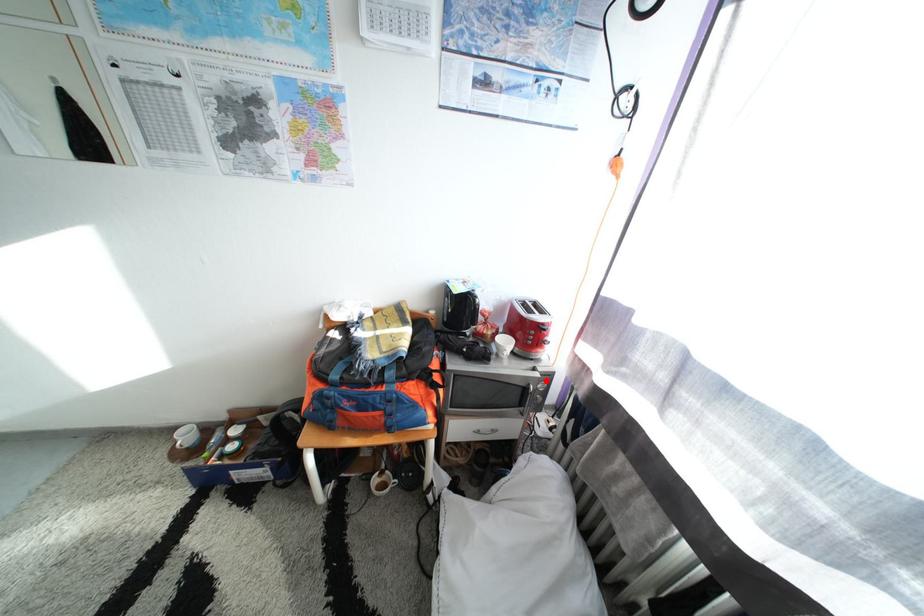
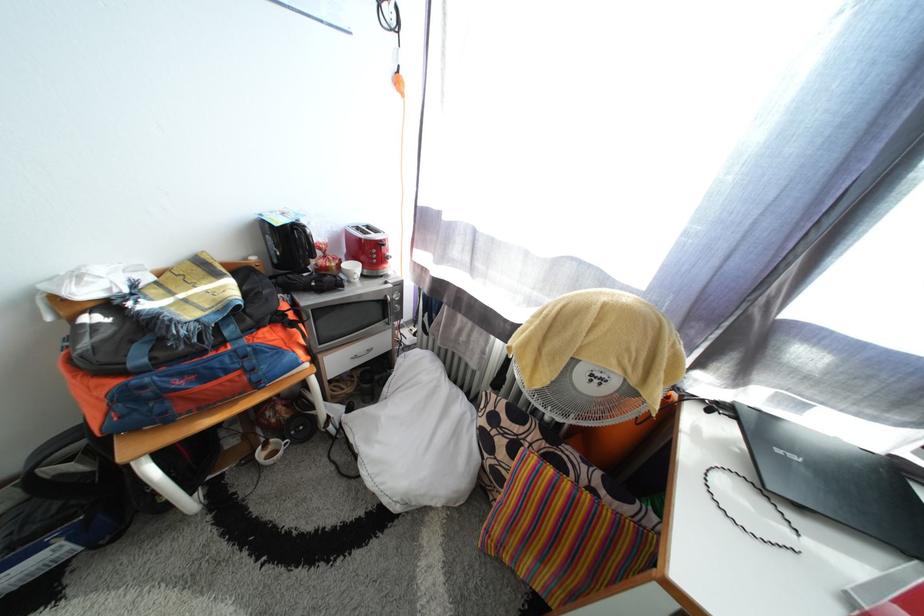
The point at the highlighted location is marked in the first image. Where is the corresponding point in the second image?

(398, 293)